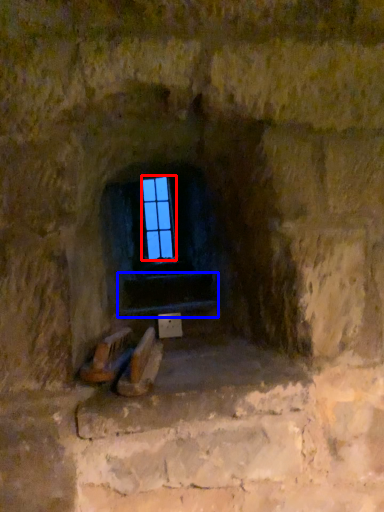
Question: Among these objects, which one is farthest to the camera, glass window (highlighted by a red box) or stairwell (highlighted by a blue box)?

Choices:
 (A) glass window
 (B) stairwell

Answer: (A)